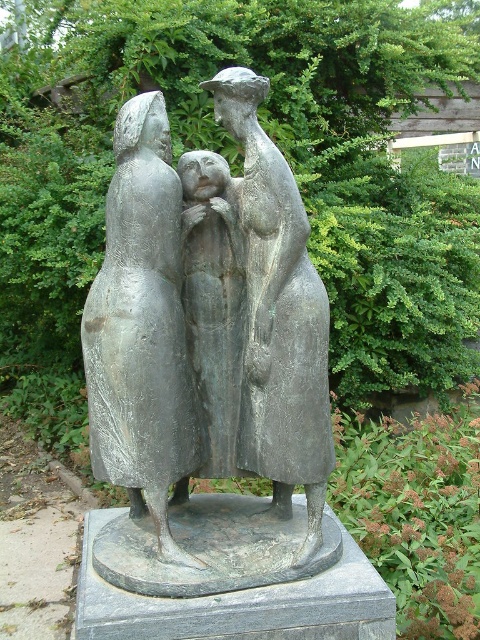
This screenshot has width=480, height=640. What are the coordinates of `matte gray statue at center` in the screenshot? It's located at (142, 330).

Can you confirm if matte gray statue at center is smaller than bronze sculpture at center?

Yes.

Is point (90, 317) farther from camera compared to point (269, 234)?

Yes, it is.

This screenshot has height=640, width=480. Identify the location of matte gray statue at center. (142, 330).

Based on the photo, can you confirm if bronze sculpture at center is positioned below bronze statue at center?

No.

Does bronze sculpture at center appear on the left side of bronze statue at center?

Yes, bronze sculpture at center is to the left of bronze statue at center.

Does point (271, 262) lie behind point (210, 298)?

That is False.

Identify the location of bronze sculpture at center. Image resolution: width=480 pixels, height=640 pixels. (277, 317).

Is point (182, 419) positioned in front of point (204, 278)?

That is True.

What do you see at coordinates (142, 330) in the screenshot? I see `matte gray statue at center` at bounding box center [142, 330].

I want to click on matte gray statue at center, so click(x=142, y=330).